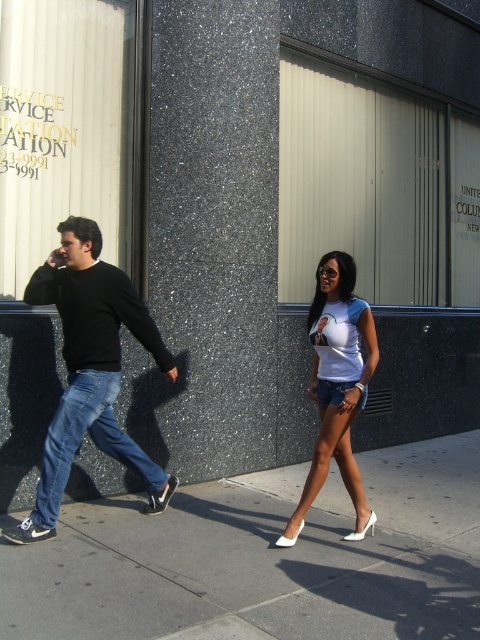
You are a photographer trying to capture a clear shot of the UNITED COLUMBIA window. You notice the concrete sidewalk at center and white matte shorts at center in your frame. Which object should you focus on to ensure the UNITED COLUMBIA text is visible?

The concrete sidewalk at center is not as tall as white matte shorts at center, so focusing on the white matte shorts at center would be better to ensure the UNITED COLUMBIA text is visible.

You are a fashion designer observing the street scene. You notice the black matte sweater at left and the white matte shorts at center. Which clothing item appears bigger in size?

The black matte sweater at left has a larger size compared to the white matte shorts at center.

You are a photographer trying to capture a photo of the black matte sweater at left and the white matte shorts at center. If you want to ensure both are in focus, which object should you adjust your camera focus to prioritize?

The black matte sweater at left is wider than the white matte shorts at center, so you should prioritize focusing on the black matte sweater at left to ensure both are in focus.